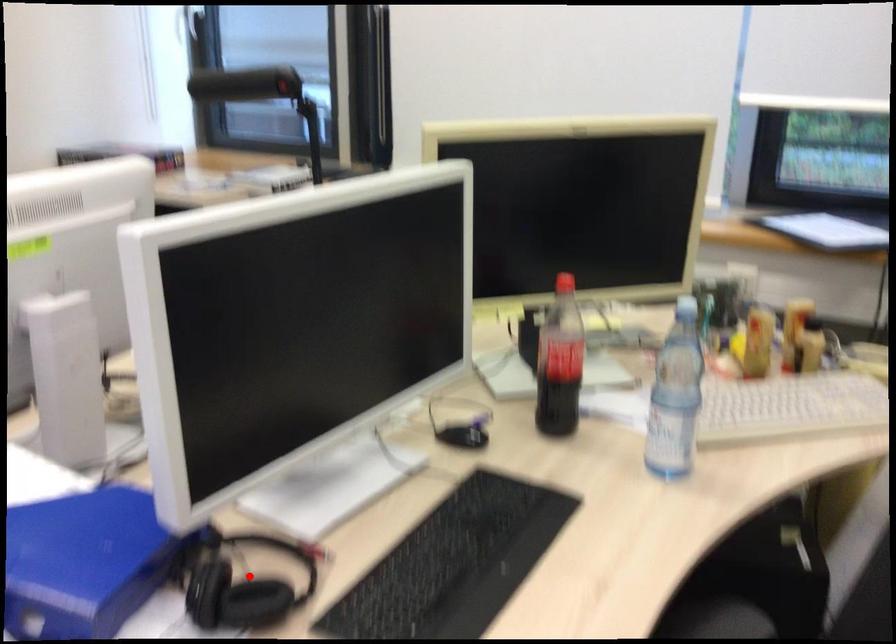
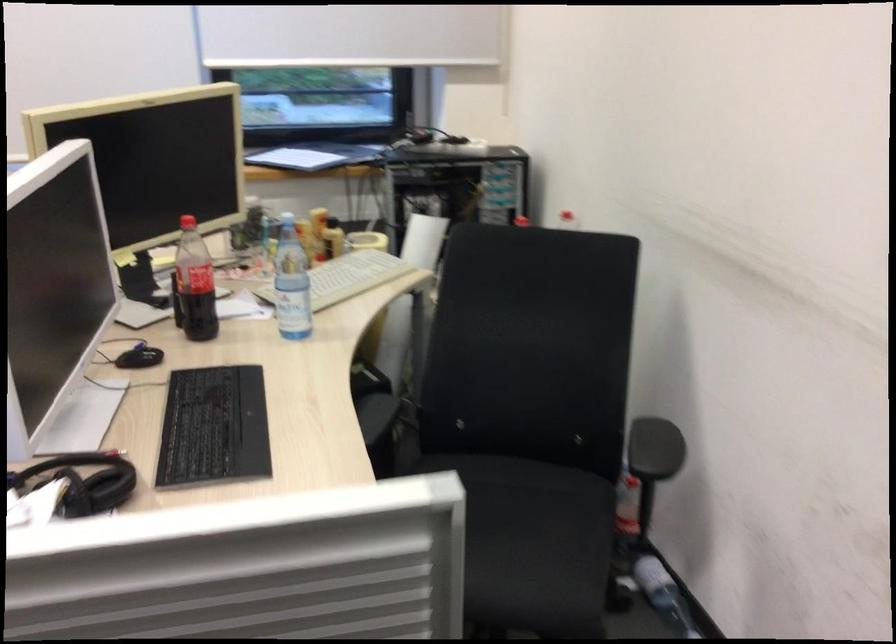
Question: I am providing you with two images of the same scene from different viewpoints. Given a red point in image1, look at the same physical point in image2. Is it:

Choices:
 (A) Closer to the viewpoint
 (B) Farther from the viewpoint

Answer: (B)